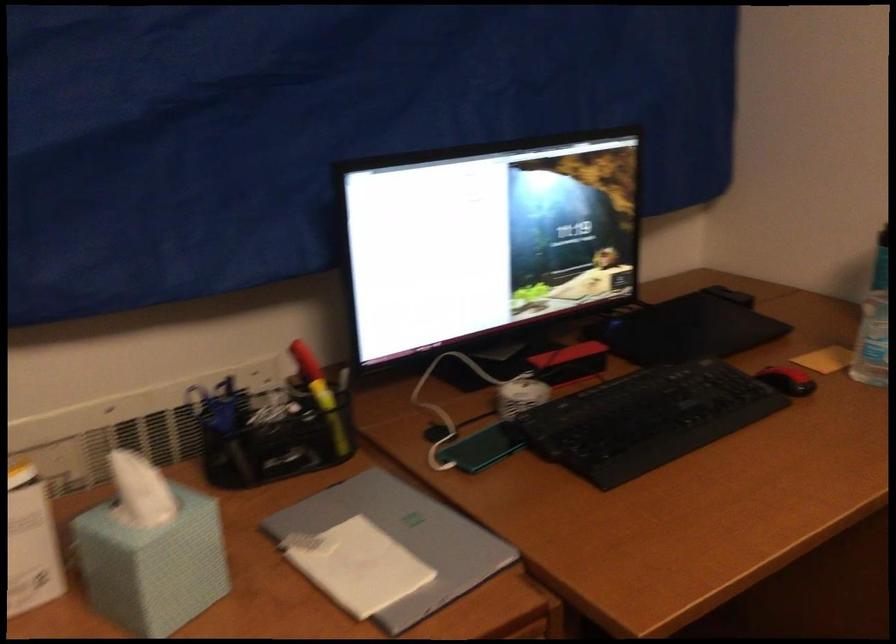
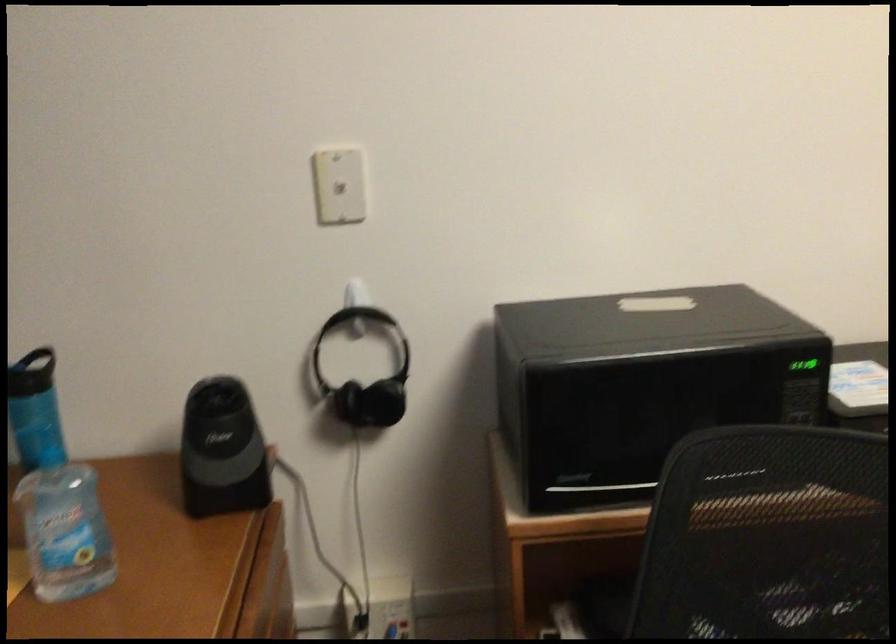
Question: Based on the continuous images, in which direction is the camera rotating? Reply with the corresponding letter.

Choices:
 (A) Left
 (B) Right
 (C) Up
 (D) Down

Answer: (B)